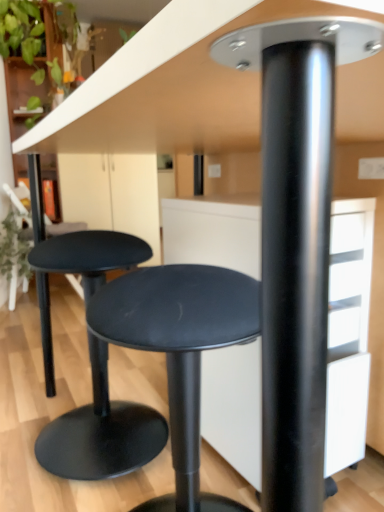
Image resolution: width=384 pixels, height=512 pixels. What do you see at coordinates (101, 431) in the screenshot? I see `matte black stool at lower left, which appears as the first stool when viewed from the back` at bounding box center [101, 431].

In order to face matte black stool at lower left, which appears as the first stool when viewed from the back, should I rotate leftwards or rightwards?

Turn left approximately 12.688 degrees to face it.

I want to click on matte black stool at lower left, positioned as the second stool in front-to-back order, so click(x=101, y=431).

What is the approximate height of matte black stool at lower left, which appears as the first stool when viewed from the back?

27.59 inches.

You are a GUI agent. You are given a task and a screenshot of the screen. Output one action in this format:
    pyautogui.click(x=<x>, y=<y>)
    Task: Click on the matte black stool at center, which is the 2th stool from back to front
    The width and height of the screenshot is (384, 512).
    Given the screenshot: What is the action you would take?
    pyautogui.click(x=180, y=350)

What do you see at coordinates (180, 350) in the screenshot?
I see `matte black stool at center, the first stool when ordered from front to back` at bounding box center [180, 350].

This screenshot has width=384, height=512. I want to click on matte black stool at lower left, which appears as the first stool when viewed from the back, so click(101, 431).

Considering the positions of objects matte black stool at center, the first stool when ordered from front to back, and matte black stool at lower left, positioned as the second stool in front-to-back order, in the image provided, who is more to the left, matte black stool at center, the first stool when ordered from front to back, or matte black stool at lower left, positioned as the second stool in front-to-back order,?

matte black stool at lower left, positioned as the second stool in front-to-back order.

Considering the positions of objects matte black stool at center, which is the 2th stool from back to front, and matte black stool at lower left, which appears as the first stool when viewed from the back, in the image provided, who is in front, matte black stool at center, which is the 2th stool from back to front, or matte black stool at lower left, which appears as the first stool when viewed from the back,?

Positioned in front is matte black stool at center, which is the 2th stool from back to front.

Is point (113, 341) more distant than point (42, 460)?

No, it is in front of (42, 460).

From the image's perspective, does matte black stool at center, which is the 2th stool from back to front, appear lower than matte black stool at lower left, positioned as the second stool in front-to-back order?

Indeed, from the image's perspective, matte black stool at center, which is the 2th stool from back to front, is shown beneath matte black stool at lower left, positioned as the second stool in front-to-back order.

From a real-world perspective, which object rests below the other?

matte black stool at center, which is the 2th stool from back to front.

Considering the relative sizes of matte black stool at center, the first stool when ordered from front to back, and matte black stool at lower left, positioned as the second stool in front-to-back order, in the image provided, is matte black stool at center, the first stool when ordered from front to back, wider than matte black stool at lower left, positioned as the second stool in front-to-back order,?

Yes.

Considering the relative sizes of matte black stool at center, the first stool when ordered from front to back, and matte black stool at lower left, positioned as the second stool in front-to-back order, in the image provided, is matte black stool at center, the first stool when ordered from front to back, taller than matte black stool at lower left, positioned as the second stool in front-to-back order,?

No, matte black stool at center, the first stool when ordered from front to back, is not taller than matte black stool at lower left, positioned as the second stool in front-to-back order.

Which of these two, matte black stool at center, the first stool when ordered from front to back, or matte black stool at lower left, which appears as the first stool when viewed from the back, is smaller?

matte black stool at center, the first stool when ordered from front to back.

Is matte black stool at lower left, positioned as the second stool in front-to-back order, a part of matte black stool at center, the first stool when ordered from front to back?

No, matte black stool at lower left, positioned as the second stool in front-to-back order, is not a part of matte black stool at center, the first stool when ordered from front to back.

Is matte black stool at center, the first stool when ordered from front to back, next to matte black stool at lower left, positioned as the second stool in front-to-back order?

No, matte black stool at center, the first stool when ordered from front to back, is not in contact with matte black stool at lower left, positioned as the second stool in front-to-back order.

Is matte black stool at center, the first stool when ordered from front to back, facing towards matte black stool at lower left, which appears as the first stool when viewed from the back?

No, matte black stool at center, the first stool when ordered from front to back, does not turn towards matte black stool at lower left, which appears as the first stool when viewed from the back.

What's the angular difference between matte black stool at center, which is the 2th stool from back to front, and matte black stool at lower left, positioned as the second stool in front-to-back order,'s facing directions?

0.000159 degrees.

How distant is matte black stool at center, which is the 2th stool from back to front, from matte black stool at lower left, positioned as the second stool in front-to-back order?

14.55 inches.

Locate an element on the screen. stool in front of the matte black stool at lower left, which appears as the first stool when viewed from the back is located at coordinates (180, 350).

Considering the positions of objects matte black stool at lower left, which appears as the first stool when viewed from the back, and matte black stool at center, which is the 2th stool from back to front, in the image provided, who is more to the left, matte black stool at lower left, which appears as the first stool when viewed from the back, or matte black stool at center, which is the 2th stool from back to front,?

From the viewer's perspective, matte black stool at lower left, which appears as the first stool when viewed from the back, appears more on the left side.

Is matte black stool at lower left, which appears as the first stool when viewed from the back, closer to the viewer compared to matte black stool at center, the first stool when ordered from front to back?

No, matte black stool at lower left, which appears as the first stool when viewed from the back, is further to the viewer.

Does point (81, 410) come in front of point (171, 359)?

No, (81, 410) is further to viewer.

Looking at this image, from the image's perspective, which one is positioned higher, matte black stool at lower left, which appears as the first stool when viewed from the back, or matte black stool at center, which is the 2th stool from back to front?

matte black stool at lower left, which appears as the first stool when viewed from the back, from the image's perspective.

From a real-world perspective, which is physically below, matte black stool at lower left, positioned as the second stool in front-to-back order, or matte black stool at center, which is the 2th stool from back to front?

matte black stool at center, which is the 2th stool from back to front, is physically lower.

Considering the relative sizes of matte black stool at lower left, which appears as the first stool when viewed from the back, and matte black stool at center, the first stool when ordered from front to back, in the image provided, is matte black stool at lower left, which appears as the first stool when viewed from the back, thinner than matte black stool at center, the first stool when ordered from front to back,?

Yes, matte black stool at lower left, which appears as the first stool when viewed from the back, is thinner than matte black stool at center, the first stool when ordered from front to back.

Considering the sizes of matte black stool at lower left, which appears as the first stool when viewed from the back, and matte black stool at center, the first stool when ordered from front to back, in the image, is matte black stool at lower left, which appears as the first stool when viewed from the back, taller or shorter than matte black stool at center, the first stool when ordered from front to back,?

In the image, matte black stool at lower left, which appears as the first stool when viewed from the back, appears to be taller than matte black stool at center, the first stool when ordered from front to back.

Does matte black stool at lower left, positioned as the second stool in front-to-back order, have a larger size compared to matte black stool at center, the first stool when ordered from front to back?

Indeed, matte black stool at lower left, positioned as the second stool in front-to-back order, has a larger size compared to matte black stool at center, the first stool when ordered from front to back.

Is matte black stool at lower left, which appears as the first stool when viewed from the back, inside the boundaries of matte black stool at center, which is the 2th stool from back to front, or outside?

matte black stool at lower left, which appears as the first stool when viewed from the back, is not inside matte black stool at center, which is the 2th stool from back to front, it's outside.

Is matte black stool at lower left, positioned as the second stool in front-to-back order, not near matte black stool at center, which is the 2th stool from back to front?

They are positioned close to each other.

Is matte black stool at lower left, which appears as the first stool when viewed from the back, oriented away from matte black stool at center, the first stool when ordered from front to back?

That's not correct — matte black stool at lower left, which appears as the first stool when viewed from the back, is not looking away from matte black stool at center, the first stool when ordered from front to back.

From the picture: Can you tell me how much matte black stool at lower left, positioned as the second stool in front-to-back order, and matte black stool at center, which is the 2th stool from back to front, differ in facing direction?

There is a 0.000159-degree angle between the facing directions of matte black stool at lower left, positioned as the second stool in front-to-back order, and matte black stool at center, which is the 2th stool from back to front.

In the image, there is a matte black stool at lower left, positioned as the second stool in front-to-back order. Where is `stool below it (from the image's perspective)`? Image resolution: width=384 pixels, height=512 pixels. stool below it (from the image's perspective) is located at coordinates (180, 350).

What are the coordinates of `stool directly beneath the matte black stool at lower left, which appears as the first stool when viewed from the back (from a real-world perspective)` in the screenshot? It's located at (180, 350).

The height and width of the screenshot is (512, 384). I want to click on stool on the right of the matte black stool at lower left, which appears as the first stool when viewed from the back, so click(180, 350).